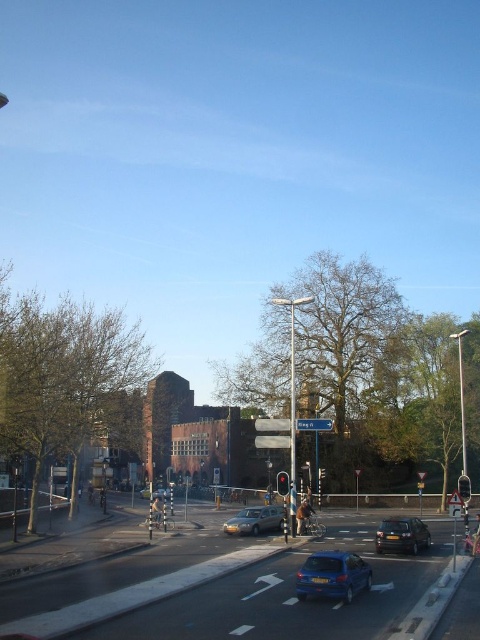
Question: Which object is farther from the camera taking this photo?

Choices:
 (A) red plastic sign at center
 (B) red glass traffic light at center
 (C) metallic silver sedan at center

Answer: (C)

Question: Which point appears farthest from the camera in this image?

Choices:
 (A) (288, 483)
 (B) (322, 588)

Answer: (A)

Question: Considering the real-world distances, which object is farthest from the red glass traffic light at center?

Choices:
 (A) red plastic sign at center
 (B) blue metallic hatchback at center

Answer: (B)

Question: Is red plastic sign at center below red glass traffic light at center?

Choices:
 (A) yes
 (B) no

Answer: (B)

Question: Is the position of red plastic sign at center less distant than that of red glass traffic light at center?

Choices:
 (A) yes
 (B) no

Answer: (B)

Question: Can you confirm if shiny black car at lower right is positioned above metallic silver sedan at center?

Choices:
 (A) no
 (B) yes

Answer: (B)